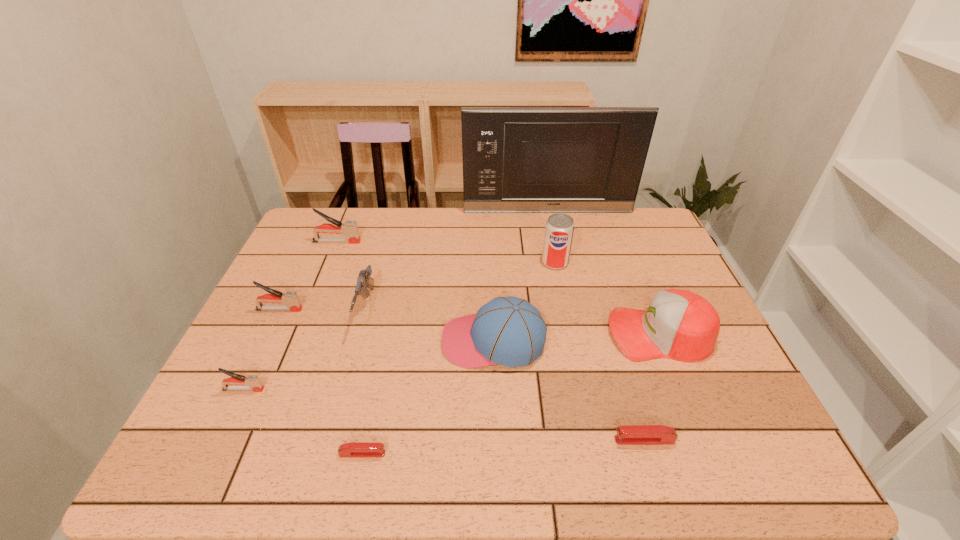
In the image, there is a desktop. Where is `free space at the near edge`? free space at the near edge is located at coordinates (593, 447).

The height and width of the screenshot is (540, 960). In the image, there is a desktop. Identify the location of vacant space at the left edge. 305,266.

At what (x,y) coordinates should I click in order to perform the action: click on vacant area at the right edge. Please return your answer as a coordinate pair (x, y). This screenshot has height=540, width=960. Looking at the image, I should click on (735, 371).

This screenshot has width=960, height=540. What are the coordinates of `empty location between the nearest stapler and the nearest gray stapler` in the screenshot? It's located at (303, 422).

Find the location of a particular element. free space between the third nearest object and the second farthest gray stapler is located at coordinates point(261,349).

This screenshot has height=540, width=960. Find the location of `free space between the eighth nearest object and the rightmost stapler`. free space between the eighth nearest object and the rightmost stapler is located at coordinates (600, 351).

The height and width of the screenshot is (540, 960). Identify the location of empty space that is in between the right baseball cap and the biggest gray stapler. (498, 288).

Find the location of a particular element. free space between the ninth tallest object and the third farthest object is located at coordinates (600, 351).

Locate an element on the screen. vacant point located between the nearest object and the fourth tallest stapler is located at coordinates (503, 447).

At what (x,y) coordinates should I click in order to perform the action: click on free space that is in between the eighth nearest object and the fourth nearest stapler. Please return your answer as a coordinate pair (x, y). The image size is (960, 540). Looking at the image, I should click on (418, 286).